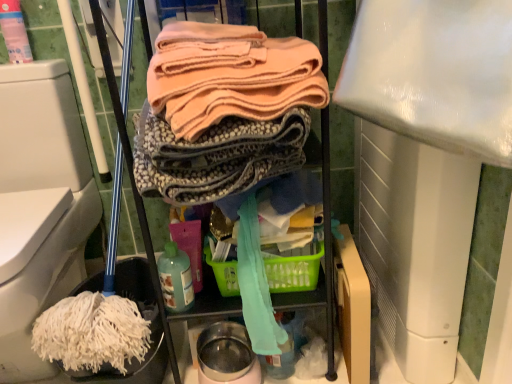
Question: Are translucent plastic bottle at lower center and pink plastic spray bottle at upper left far apart?

Choices:
 (A) yes
 (B) no

Answer: (B)

Question: Does translucent plastic bottle at lower center turn towards pink plastic spray bottle at upper left?

Choices:
 (A) no
 (B) yes

Answer: (A)

Question: Is translucent plastic bottle at lower center taller than pink plastic spray bottle at upper left?

Choices:
 (A) no
 (B) yes

Answer: (A)

Question: Considering the relative positions of translucent plastic bottle at lower center and pink plastic spray bottle at upper left in the image provided, is translucent plastic bottle at lower center behind pink plastic spray bottle at upper left?

Choices:
 (A) no
 (B) yes

Answer: (A)

Question: Is translucent plastic bottle at lower center positioned beyond the bounds of pink plastic spray bottle at upper left?

Choices:
 (A) yes
 (B) no

Answer: (A)

Question: Is pink plastic spray bottle at upper left inside or outside of white fabric mop head at lower left?

Choices:
 (A) inside
 (B) outside

Answer: (B)

Question: Considering the relative positions of pink plastic spray bottle at upper left and white fabric mop head at lower left in the image provided, is pink plastic spray bottle at upper left to the left or to the right of white fabric mop head at lower left?

Choices:
 (A) left
 (B) right

Answer: (B)

Question: From a real-world perspective, is pink plastic spray bottle at upper left positioned above or below white fabric mop head at lower left?

Choices:
 (A) below
 (B) above

Answer: (B)

Question: Considering the positions of point (23, 21) and point (78, 226), is point (23, 21) closer or farther from the camera than point (78, 226)?

Choices:
 (A) closer
 (B) farther

Answer: (A)

Question: From the image's perspective, is translucent plastic bottle at lower center above or below pink plastic spray bottle at upper left?

Choices:
 (A) below
 (B) above

Answer: (A)

Question: Is translucent plastic bottle at lower center bigger or smaller than pink plastic spray bottle at upper left?

Choices:
 (A) big
 (B) small

Answer: (B)

Question: In terms of width, does translucent plastic bottle at lower center look wider or thinner when compared to pink plastic spray bottle at upper left?

Choices:
 (A) thin
 (B) wide

Answer: (B)

Question: Relative to pink plastic spray bottle at upper left, is translucent plastic bottle at lower center in front or behind?

Choices:
 (A) front
 (B) behind

Answer: (A)

Question: Is point (215, 274) closer or farther from the camera than point (168, 268)?

Choices:
 (A) farther
 (B) closer

Answer: (A)

Question: From their relative heights in the image, would you say green plastic basket at center is taller or shorter than translucent plastic bottle at lower center?

Choices:
 (A) tall
 (B) short

Answer: (B)